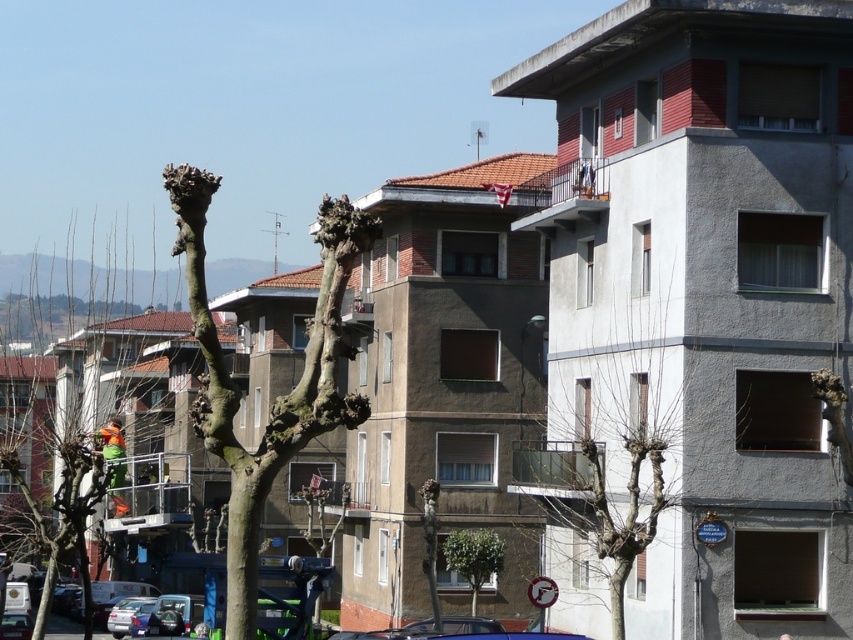
Is green leafy tree at center bigger than metallic silver car at lower left?

No, green leafy tree at center is not bigger than metallic silver car at lower left.

Who is positioned more to the right, green leafy tree at center or metallic silver car at lower left?

green leafy tree at center

Describe the element at coordinates (473, 557) in the screenshot. I see `green leafy tree at center` at that location.

Locate an element on the screen. This screenshot has height=640, width=853. green leafy tree at center is located at coordinates (473, 557).

Is point (55, 369) farther from camera compared to point (157, 625)?

That is True.

Between bare branches at left and metallic silver car at lower left, which one has more height?

With more height is bare branches at left.

What do you see at coordinates (50, 460) in the screenshot? I see `bare branches at left` at bounding box center [50, 460].

At what (x,y) coordinates should I click in order to perform the action: click on bare branches at left. Please return your answer as a coordinate pair (x, y). Looking at the image, I should click on (50, 460).

Can you confirm if bare branches at center is bigger than green leafy tree at center?

Indeed, bare branches at center has a larger size compared to green leafy tree at center.

Which is below, bare branches at center or green leafy tree at center?

green leafy tree at center is lower down.

Which is in front, point (666, 429) or point (498, 570)?

Point (666, 429) is more forward.

The height and width of the screenshot is (640, 853). I want to click on bare branches at center, so click(608, 440).